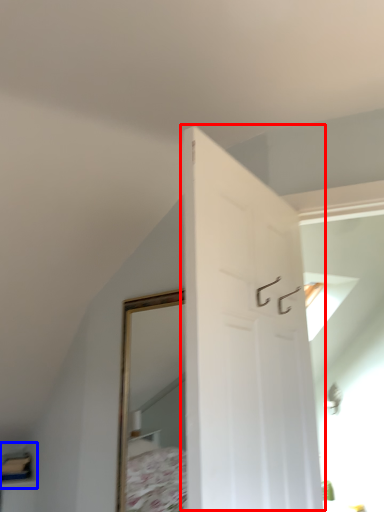
Question: Which point is closer to the camera, door (highlighted by a red box) or shelf (highlighted by a blue box)?

Choices:
 (A) door
 (B) shelf

Answer: (A)